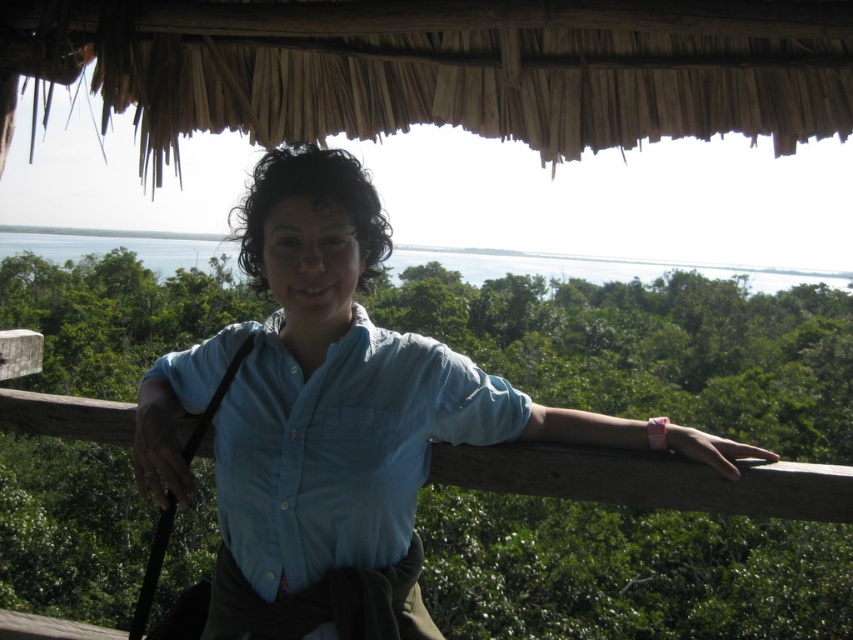
Is point (251, 627) in front of point (223, 506)?

Yes, point (251, 627) is in front of point (223, 506).

Describe the element at coordinates (337, 420) in the screenshot. The width and height of the screenshot is (853, 640). I see `blue cotton shirt at center` at that location.

The height and width of the screenshot is (640, 853). Find the location of `blue cotton shirt at center`. blue cotton shirt at center is located at coordinates (337, 420).

Where is `blue cotton shirt at center`? blue cotton shirt at center is located at coordinates (337, 420).